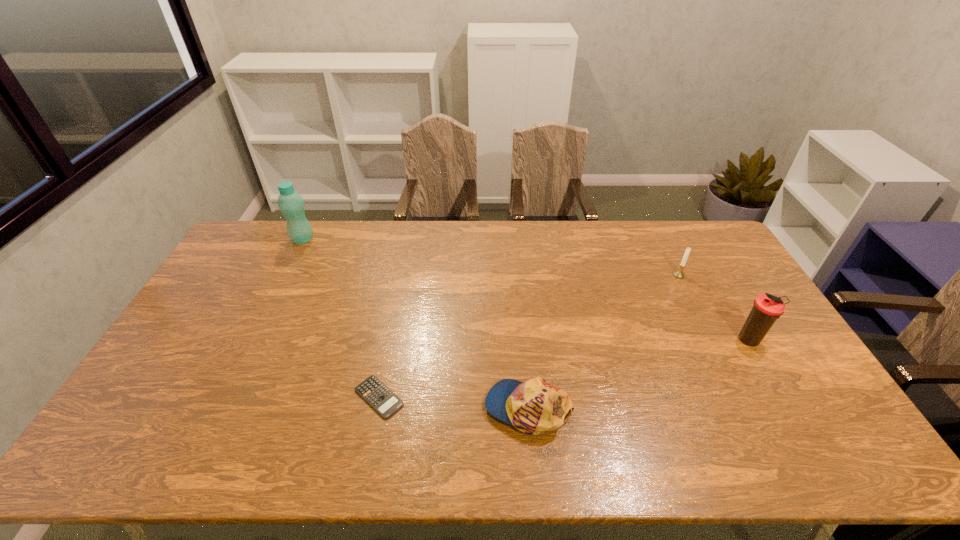
I want to click on free space located 0.200m on the right of the leftmost object, so click(x=368, y=239).

Identify the location of vacant space situated 0.390m on the left of the fourth shortest object. The image size is (960, 540). tap(605, 341).

Where is `blank space located 0.270m on the left of the candle holder`? Image resolution: width=960 pixels, height=540 pixels. blank space located 0.270m on the left of the candle holder is located at coordinates (594, 275).

The image size is (960, 540). Identify the location of vacant region located on the bill of the cap. (419, 408).

Where is `free space located 0.330m on the bill of the cap`? The width and height of the screenshot is (960, 540). free space located 0.330m on the bill of the cap is located at coordinates [357, 408].

The image size is (960, 540). I want to click on free location located 0.400m on the bill of the cap, so click(x=329, y=408).

You are a GUI agent. You are given a task and a screenshot of the screen. Output one action in this format:
    pyautogui.click(x=<x>, y=<y>)
    Task: Click on the vacant space located 0.230m on the back of the second object from left to right
    The height and width of the screenshot is (540, 960).
    Given the screenshot: What is the action you would take?
    pyautogui.click(x=396, y=315)

You are a GUI agent. You are given a task and a screenshot of the screen. Output one action in this format:
    pyautogui.click(x=<x>, y=<y>)
    Task: Click on the object located at the far edge
    
    Given the screenshot: What is the action you would take?
    pyautogui.click(x=291, y=204)

Find the location of `object that is at the near edge`. object that is at the near edge is located at coordinates (535, 406).

Locate an element on the screen. Image resolution: width=960 pixels, height=540 pixels. object that is at the right edge is located at coordinates (767, 308).